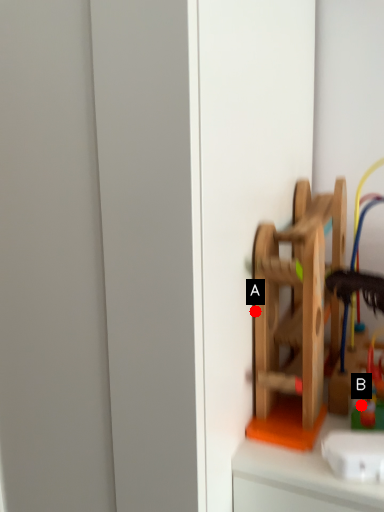
Question: Two points are circled on the image, labeled by A and B beside each circle. Which point is further to the camera?

Choices:
 (A) A is further
 (B) B is further

Answer: (B)